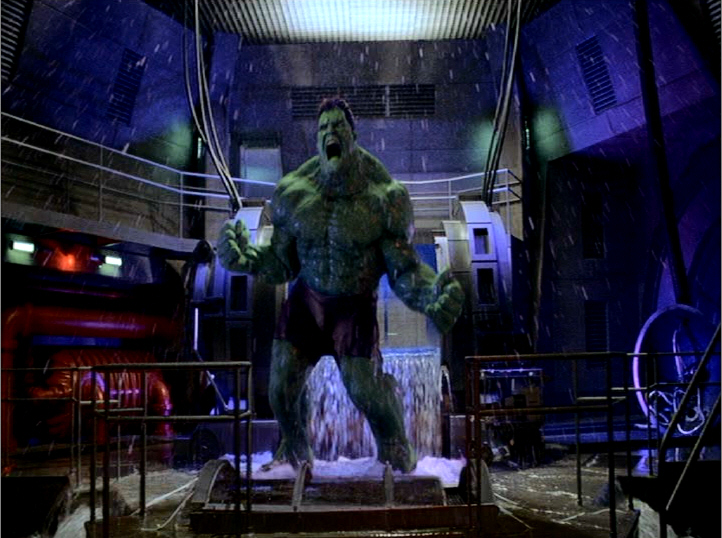
Identify the location of vents. This screenshot has width=722, height=538. (604, 81), (399, 106).